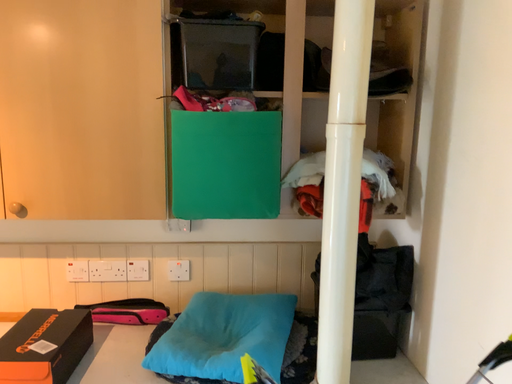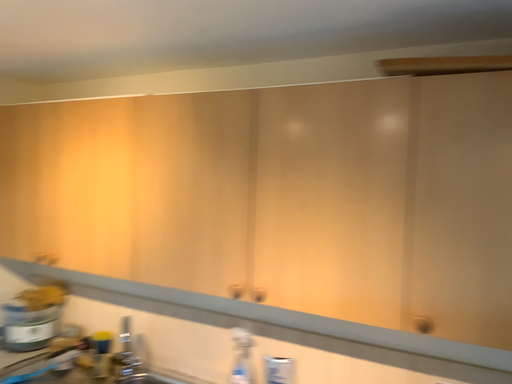
Question: How did the camera likely rotate when shooting the video?

Choices:
 (A) rotated right
 (B) rotated left

Answer: (B)